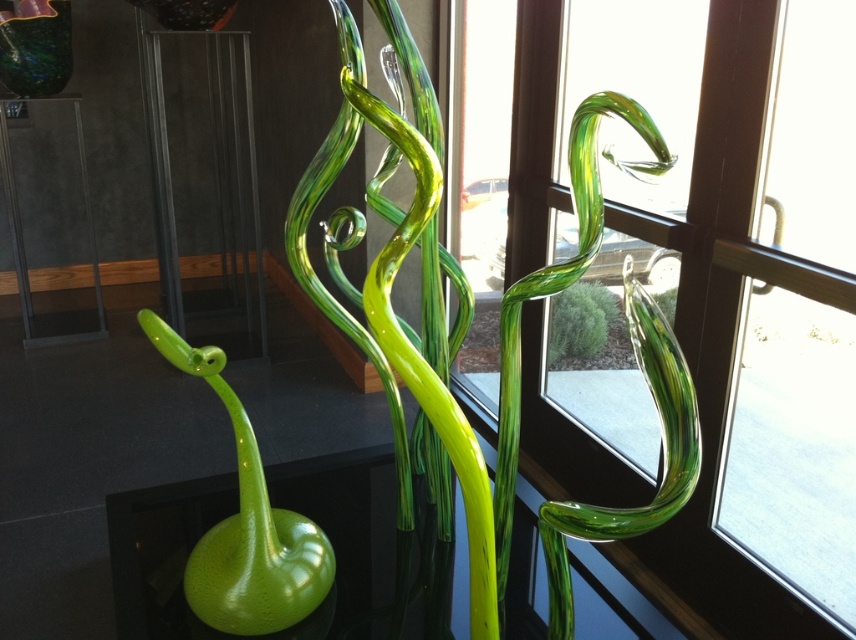
Which of these two, green glass sculpture at center or matte black table at left, stands shorter?

green glass sculpture at center is shorter.

Locate an element on the screen. Image resolution: width=856 pixels, height=640 pixels. green glass sculpture at center is located at coordinates (403, 330).

Between green glass sculpture at center and green glass plant at center, which one appears on the left side from the viewer's perspective?

green glass sculpture at center

Is green glass sculpture at center bigger than green glass plant at center?

Indeed, green glass sculpture at center has a larger size compared to green glass plant at center.

What do you see at coordinates (403, 330) in the screenshot?
I see `green glass sculpture at center` at bounding box center [403, 330].

Where is `green glass sculpture at center`? green glass sculpture at center is located at coordinates (403, 330).

Does shiny multicolored glass vase at upper left appear under green glass plant at center?

Actually, shiny multicolored glass vase at upper left is above green glass plant at center.

Does shiny multicolored glass vase at upper left have a smaller size compared to green glass plant at center?

Yes, shiny multicolored glass vase at upper left is smaller than green glass plant at center.

What do you see at coordinates (34, 45) in the screenshot?
I see `shiny multicolored glass vase at upper left` at bounding box center [34, 45].

The image size is (856, 640). What are the coordinates of `shiny multicolored glass vase at upper left` in the screenshot? It's located at (34, 45).